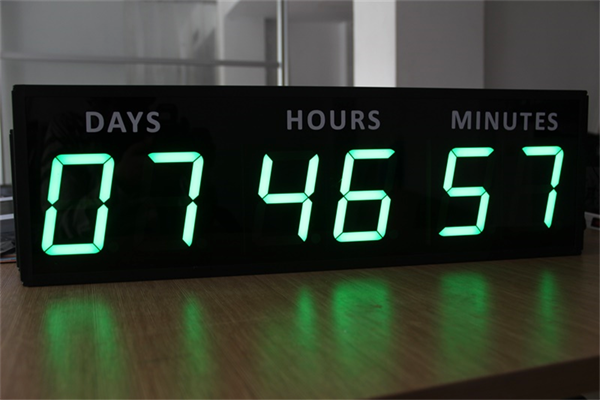
Identify the location of empty space on table. (246, 347).